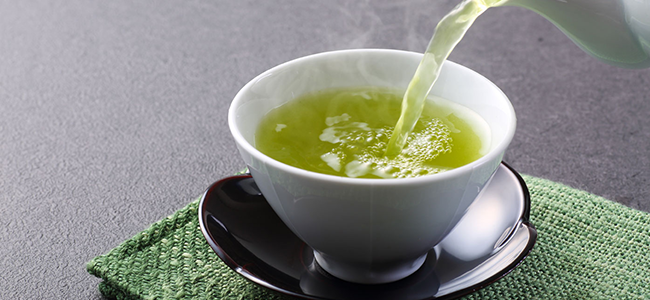
I want to click on tea pot, so click(577, 18).